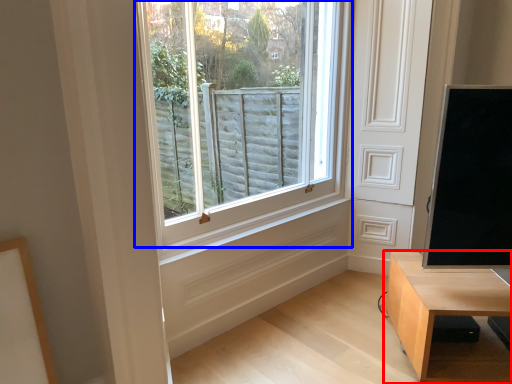
Question: Which object is closer to the camera taking this photo, table (highlighted by a red box) or window (highlighted by a blue box)?

Choices:
 (A) table
 (B) window

Answer: (A)